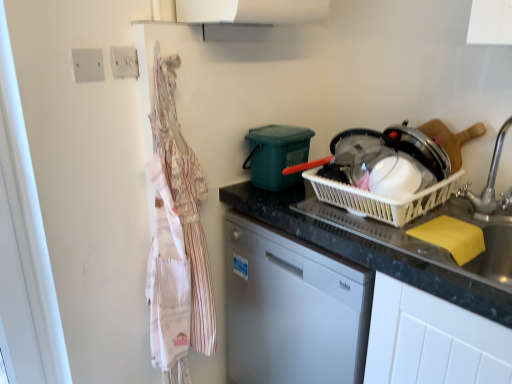
The width and height of the screenshot is (512, 384). I want to click on vacant space underneath silver metallic faucet at right (from a real-world perspective), so click(487, 211).